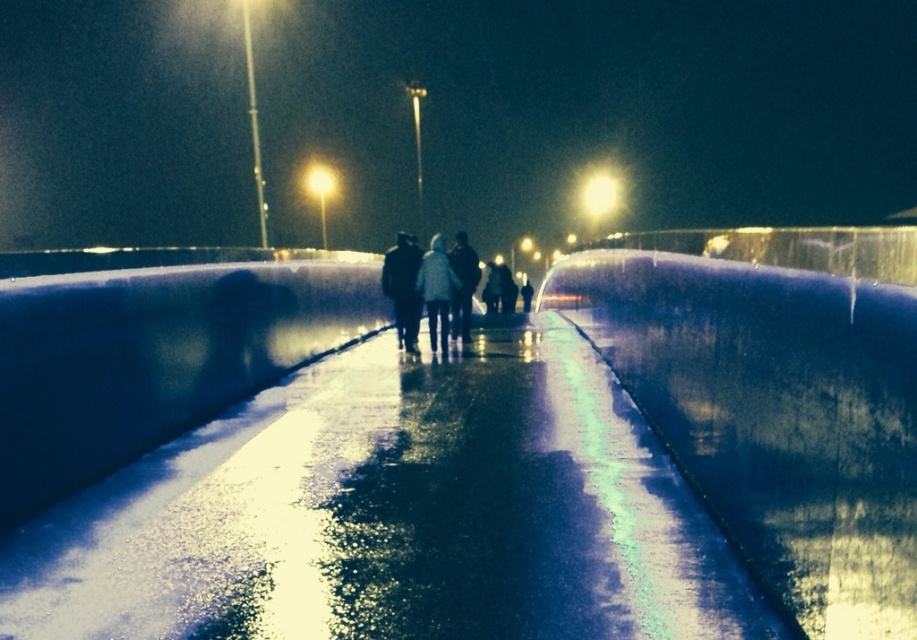
Question: From the image, what is the correct spatial relationship of smooth concrete wall at center in relation to white matte jacket at center?

Choices:
 (A) above
 (B) below

Answer: (A)

Question: Is silhouette wool coat at center below white woolen sweater at center?

Choices:
 (A) yes
 (B) no

Answer: (A)

Question: Estimate the real-world distances between objects in this image. Which object is farther from the white matte jacket at center?

Choices:
 (A) glossy concrete path at center
 (B) silhouette wool coat at center
 (C) smooth concrete wall at center
 (D) dark fabric coat at center

Answer: (A)

Question: Which of the following is the closest to the observer?

Choices:
 (A) smooth concrete wall at center
 (B) silhouette wool coat at center
 (C) white matte jacket at center

Answer: (A)

Question: Which object appears closest to the camera in this image?

Choices:
 (A) white woolen sweater at center
 (B) silhouette wool coat at center
 (C) smooth concrete wall at center

Answer: (C)

Question: Does glossy concrete path at center have a lesser width compared to smooth concrete wall at center?

Choices:
 (A) yes
 (B) no

Answer: (B)